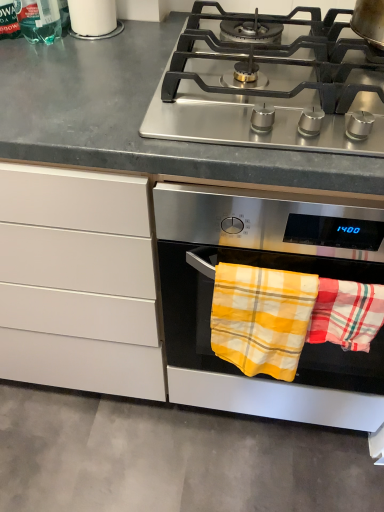
Question: Should I look upward or downward to see stainless steel gas stove at upper center?

Choices:
 (A) up
 (B) down

Answer: (A)

Question: Is translucent green bottle at upper left closer to the viewer compared to yellow plaid towel at lower right, the second beach towel positioned from the left?

Choices:
 (A) yes
 (B) no

Answer: (A)

Question: Is translucent green bottle at upper left in contact with yellow plaid towel at lower right, the second beach towel positioned from the left?

Choices:
 (A) no
 (B) yes

Answer: (A)

Question: Considering the relative sizes of translucent green bottle at upper left and yellow plaid towel at lower right, the second beach towel positioned from the left, in the image provided, is translucent green bottle at upper left smaller than yellow plaid towel at lower right, the second beach towel positioned from the left,?

Choices:
 (A) no
 (B) yes

Answer: (A)

Question: Is translucent green bottle at upper left positioned beyond the bounds of yellow plaid towel at lower right, the second beach towel positioned from the left?

Choices:
 (A) no
 (B) yes

Answer: (B)

Question: Is translucent green bottle at upper left positioned with its back to yellow plaid towel at lower right, the 1th beach towel in the right-to-left sequence?

Choices:
 (A) no
 (B) yes

Answer: (A)

Question: From a real-world perspective, is translucent green bottle at upper left under yellow plaid towel at lower right, the second beach towel positioned from the left?

Choices:
 (A) yes
 (B) no

Answer: (B)

Question: Is the depth of stainless steel gas stove at upper center greater than that of stainless steel pot at upper right?

Choices:
 (A) no
 (B) yes

Answer: (A)

Question: Would you say stainless steel gas stove at upper center is a long distance from stainless steel pot at upper right?

Choices:
 (A) no
 (B) yes

Answer: (A)

Question: Is stainless steel gas stove at upper center to the right of stainless steel pot at upper right from the viewer's perspective?

Choices:
 (A) yes
 (B) no

Answer: (B)

Question: Is stainless steel gas stove at upper center not inside stainless steel pot at upper right?

Choices:
 (A) no
 (B) yes

Answer: (B)

Question: Does stainless steel gas stove at upper center have a lesser height compared to stainless steel pot at upper right?

Choices:
 (A) yes
 (B) no

Answer: (A)

Question: Would you say stainless steel gas stove at upper center contains stainless steel pot at upper right?

Choices:
 (A) no
 (B) yes

Answer: (A)

Question: Is white glossy cup at upper left shorter than stainless steel gas stove at upper center?

Choices:
 (A) yes
 (B) no

Answer: (B)